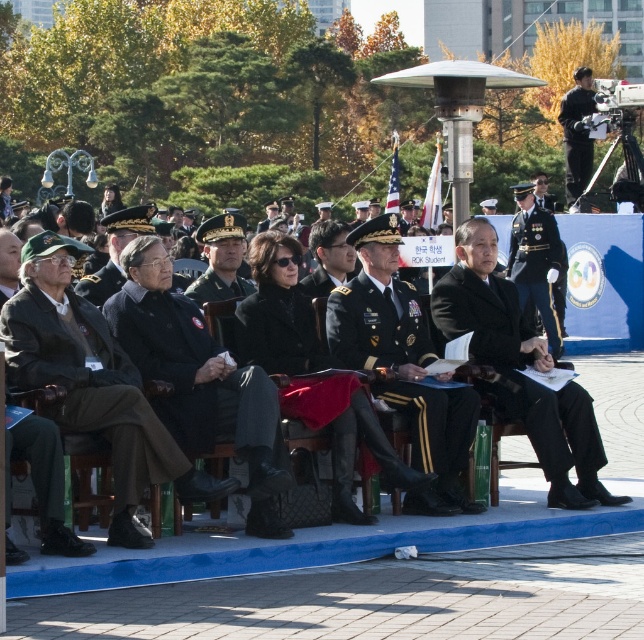
You are a photographer at this event and need to adjust the camera focus to capture both the black matte suit at center and the shiny black uniform at center clearly. Which one should you focus on first to ensure proper depth of field?

The black matte suit at center has a lesser height compared to shiny black uniform at center, so you should focus on the shiny black uniform at center first as it is farther away, ensuring the depth of field captures both subjects properly.

Consider the image. You are an event organizer who needs to ensure that the dark brown wool coat at center and the black matte suit at center are visible to the camera positioned above the stage. Which object is closer to the camera and will appear larger in the photo?

The black matte suit at center is closer to the camera because the dark brown wool coat at center is located below it, so the black matte suit at center will appear larger in the photo.

From the picture: You are a photographer standing at the back of the audience. You need to take a clear photo of the dark gray uniform at center and the black matte uniform at upper right. Considering the distance between them, will you be able to frame both subjects in the same shot without zooming in?

The distance between the dark gray uniform at center and the black matte uniform at upper right is 27.52 meters. Since the photographer is at the back, it might be challenging to frame both in the same shot without zooming, as the subjects are quite far apart.